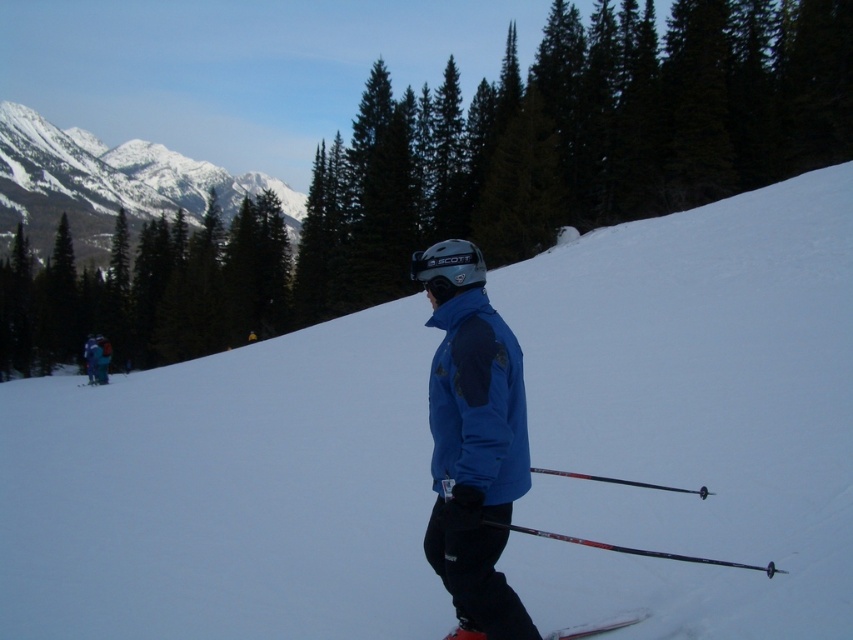
Question: Can you confirm if snowy mountain at upper left is thinner than blue fabric jacket at lower left?

Choices:
 (A) yes
 (B) no

Answer: (B)

Question: Which point is closer to the camera?

Choices:
 (A) dark blue jacket at lower left
 (B) snowy mountain at upper left

Answer: (A)

Question: Is green matte tree at upper center to the left of blue fabric jacket at lower left from the viewer's perspective?

Choices:
 (A) no
 (B) yes

Answer: (A)

Question: Estimate the real-world distances between objects in this image. Which object is closer to the snowy mountain at upper left?

Choices:
 (A) blue softshell jacket at center
 (B) green matte tree at upper center
 (C) blue fabric jacket at lower left
 (D) green matte tree at upper left

Answer: (D)

Question: Considering the relative positions of snowy mountain at upper left and blue fabric jacket at lower left in the image provided, where is snowy mountain at upper left located with respect to blue fabric jacket at lower left?

Choices:
 (A) below
 (B) above

Answer: (B)

Question: Which point is closer to the camera?

Choices:
 (A) snowy mountain at upper left
 (B) dark blue jacket at lower left
 (C) green matte tree at upper center

Answer: (B)